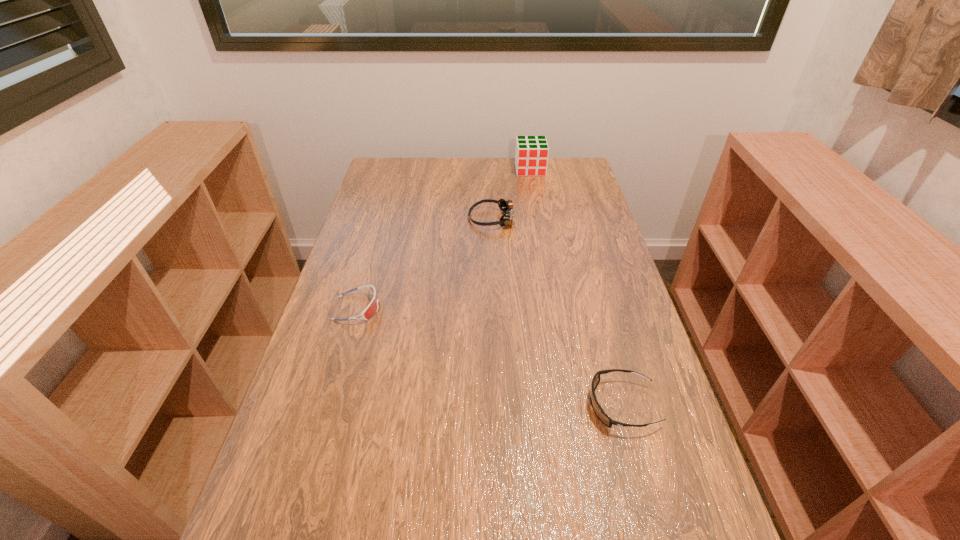
Identify the location of the farthest object. The width and height of the screenshot is (960, 540). (531, 155).

I want to click on cube, so click(x=531, y=155).

This screenshot has height=540, width=960. What are the coordinates of `the second goggles from right to left` in the screenshot? It's located at (506, 206).

Find the location of `the third object from right to left`. the third object from right to left is located at coordinates (506, 206).

Where is `the rightmost goggles`? This screenshot has width=960, height=540. the rightmost goggles is located at coordinates (602, 416).

Locate an element on the screen. The width and height of the screenshot is (960, 540). the nearest object is located at coordinates (602, 416).

This screenshot has width=960, height=540. I want to click on the leftmost goggles, so click(x=371, y=309).

Locate an element on the screen. The image size is (960, 540). the third farthest object is located at coordinates (371, 309).

Where is `free region located on the red face of the tallest object`? The image size is (960, 540). free region located on the red face of the tallest object is located at coordinates (539, 217).

Identify the location of vacant area situated 0.080m through the lenses of the second farthest object. This screenshot has width=960, height=540. (444, 219).